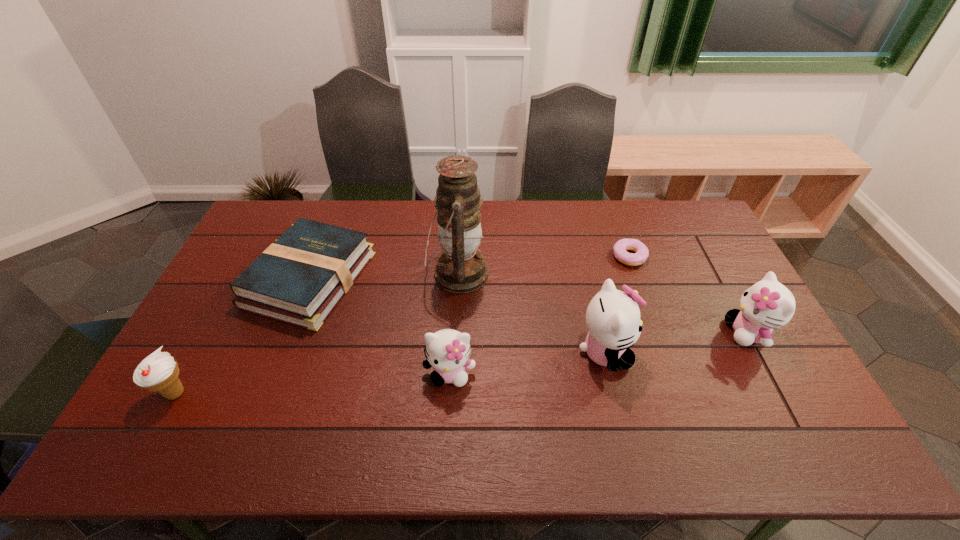
Find the location of a particular element. Image resolution: width=960 pixels, height=540 pixels. empty space that is in between the tallest object and the shortest object is located at coordinates [543, 265].

Where is `unoccupied position between the icecream and the fifth object from left to right`? The image size is (960, 540). unoccupied position between the icecream and the fifth object from left to right is located at coordinates (390, 373).

Where is `free space between the lantern and the sixth tallest object`? The height and width of the screenshot is (540, 960). free space between the lantern and the sixth tallest object is located at coordinates tap(384, 276).

At what (x,y) coordinates should I click in order to perform the action: click on free space between the shortest kitten and the second object from right to left. Please return your answer as a coordinate pair (x, y). This screenshot has width=960, height=540. Looking at the image, I should click on (540, 315).

At what (x,y) coordinates should I click in order to perform the action: click on free space between the tallest object and the doughnut. Please return your answer as a coordinate pair (x, y). This screenshot has width=960, height=540. Looking at the image, I should click on (543, 265).

Identify the location of unoccupied position between the fifth object from left to right and the shortest kitten. (527, 362).

Find the location of `free space between the second kitten from left to right and the leftmost kitten`. free space between the second kitten from left to right and the leftmost kitten is located at coordinates (527, 362).

Locate an element on the screen. free space between the shortest kitten and the tallest object is located at coordinates (454, 323).

Identify the location of free space between the hardback book and the shortest kitten. (380, 326).

Locate an element on the screen. object that ranks as the closest to the rightmost object is located at coordinates (x=641, y=254).